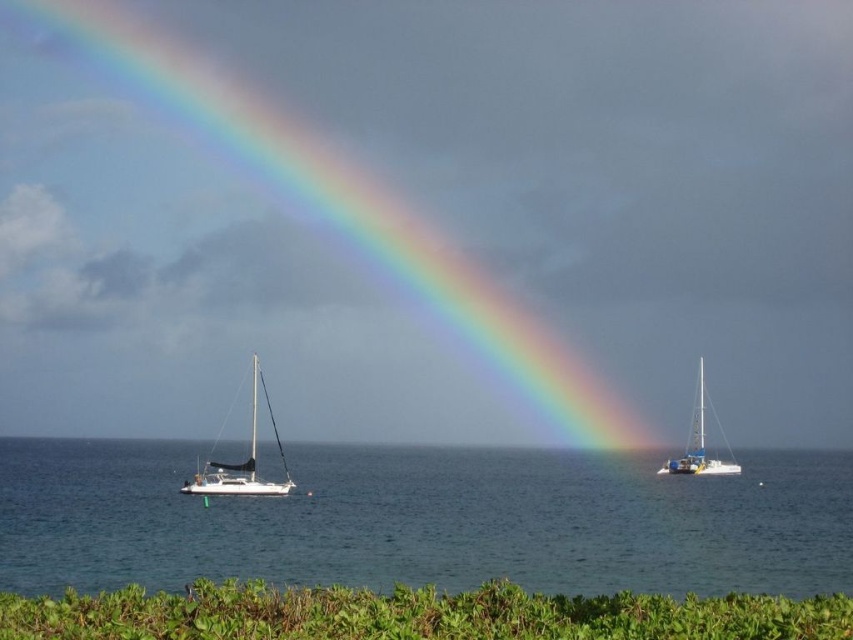
Question: Can you confirm if rainbow at upper center is wider than blue metallic sailboat at right?

Choices:
 (A) no
 (B) yes

Answer: (B)

Question: Which point appears closest to the camera in this image?

Choices:
 (A) (244, 464)
 (B) (262, 609)
 (C) (697, 376)
 (D) (24, 464)

Answer: (B)

Question: Can you confirm if rainbow at upper center is bigger than green leafy vegetation at lower center?

Choices:
 (A) yes
 (B) no

Answer: (A)

Question: Does clear blue water at lower center have a larger size compared to blue metallic sailboat at right?

Choices:
 (A) yes
 (B) no

Answer: (A)

Question: Which point is farther to the camera?

Choices:
 (A) (666, 564)
 (B) (726, 444)
 (C) (68, 417)
 (D) (546, 616)

Answer: (C)

Question: Which point is closer to the camera?

Choices:
 (A) white glossy sailboat at center
 (B) rainbow at upper center
 (C) green leafy vegetation at lower center
 (D) clear blue water at lower center

Answer: (C)